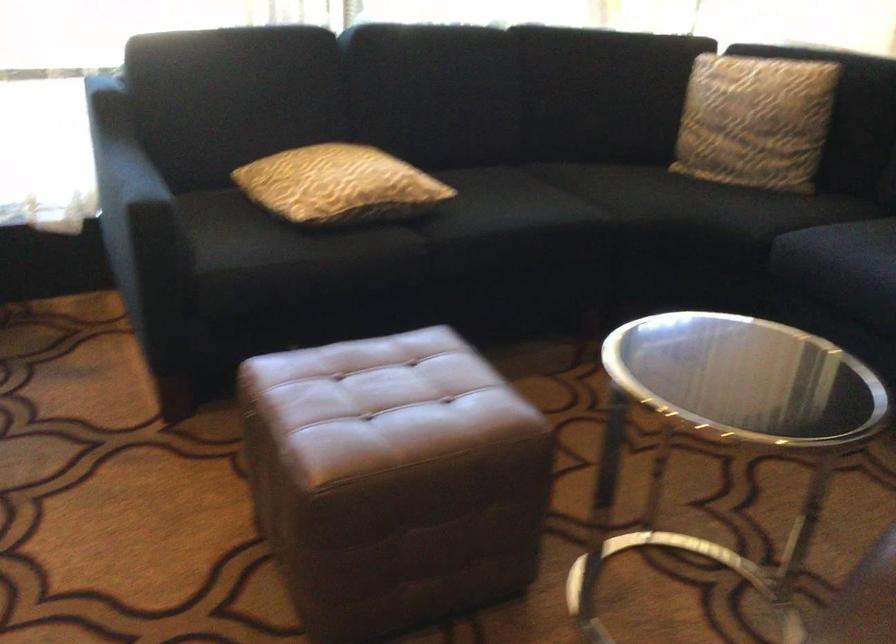
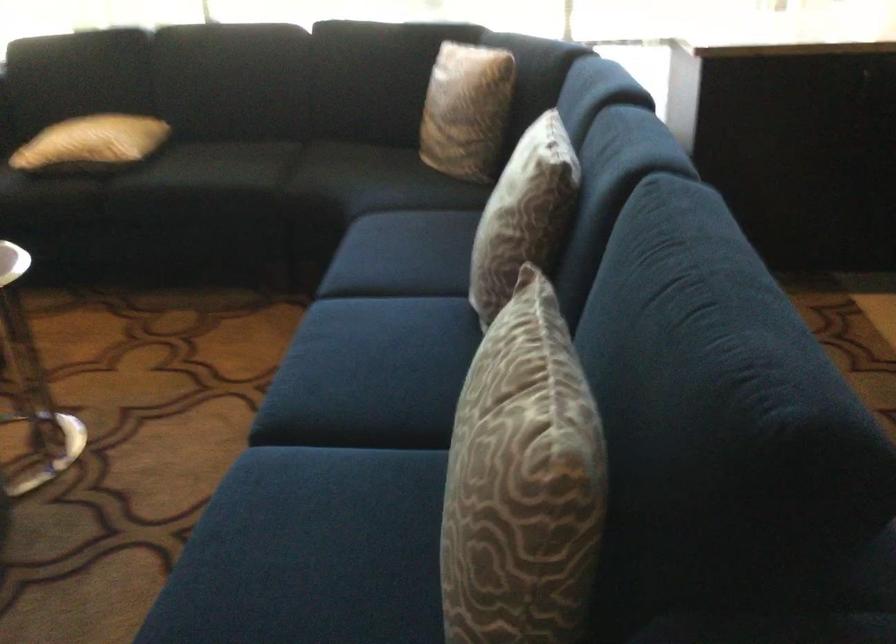
Question: The images are taken continuously from a first-person perspective. In which direction are you moving?

Choices:
 (A) Left
 (B) Right
 (C) Forward
 (D) Backward

Answer: (B)